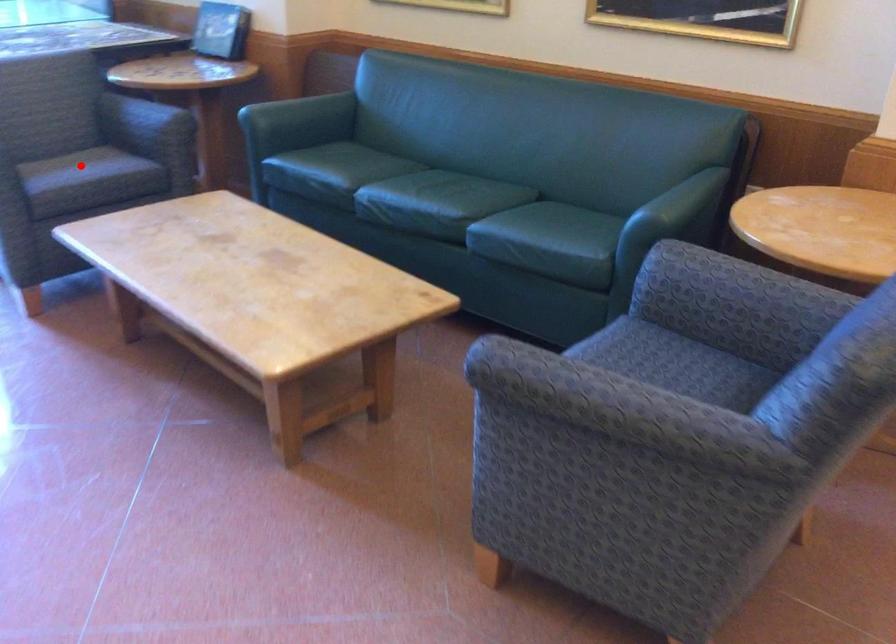
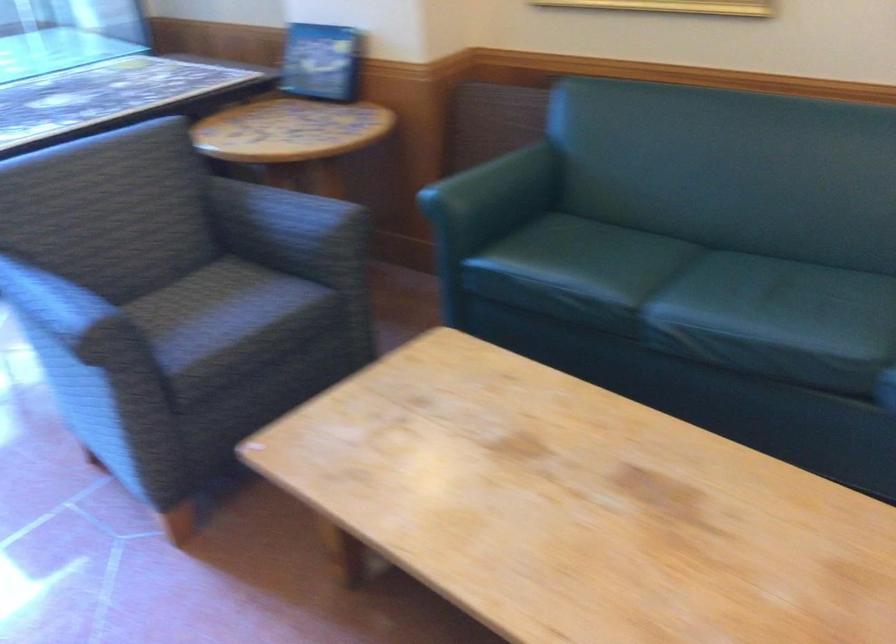
Question: I am providing you with two images of the same scene from different viewpoints. A red point is shown in image1. For the corresponding object point in image2, is it positioned nearer or farther from the camera?

Choices:
 (A) Nearer
 (B) Farther

Answer: (A)